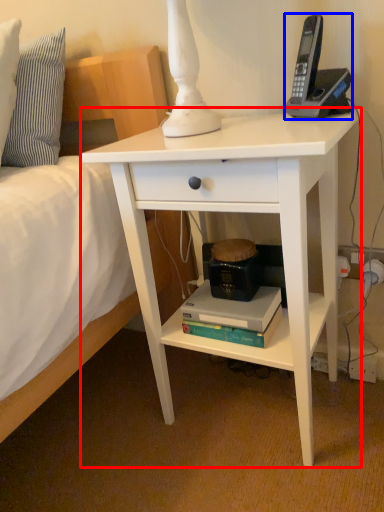
Question: Which object appears closest to the camera in this image, desk (highlighted by a red box) or corded phone (highlighted by a blue box)?

Choices:
 (A) desk
 (B) corded phone

Answer: (A)